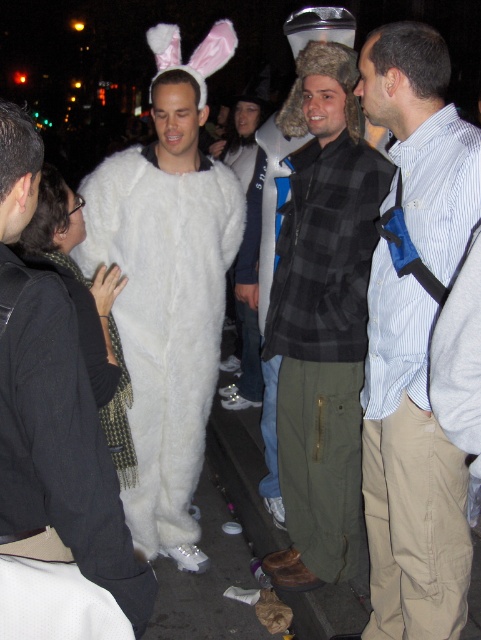
Does point (220, 225) come in front of point (36, 308)?

No, (220, 225) is further to viewer.

Which is more to the right, white furry costume at left or white furry costume at center?

white furry costume at left

Find the location of a particular element. white furry costume at left is located at coordinates pyautogui.click(x=168, y=285).

Can you confirm if black flannel shirt at center is wider than white furry costume at center?

Indeed, black flannel shirt at center has a greater width compared to white furry costume at center.

Is black flannel shirt at center shorter than white furry costume at center?

No, black flannel shirt at center is not shorter than white furry costume at center.

Is point (343, 131) more distant than point (98, 442)?

Yes, point (343, 131) is farther from viewer.

Where is `black flannel shirt at center`? black flannel shirt at center is located at coordinates (x=323, y=316).

Between striped cotton shirt at center and black flannel shirt at center, which one has more height?

black flannel shirt at center

Is striped cotton shirt at center taller than black flannel shirt at center?

Incorrect, striped cotton shirt at center's height is not larger of black flannel shirt at center's.

Does point (422, 513) come in front of point (293, 408)?

That is True.

Locate an element on the screen. The width and height of the screenshot is (481, 640). striped cotton shirt at center is located at coordinates (415, 342).